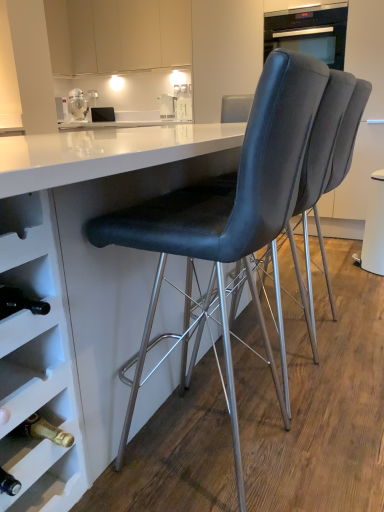
Question: Is matte black chair at center, the 3th chair positioned from the front, further to the viewer compared to black leather chair at center, marked as the second chair in a front-to-back arrangement?

Choices:
 (A) no
 (B) yes

Answer: (B)

Question: From the image's perspective, is matte black chair at center, the 3th chair positioned from the front, located beneath black leather chair at center, marked as the second chair in a front-to-back arrangement?

Choices:
 (A) no
 (B) yes

Answer: (A)

Question: Does matte black chair at center, the 3th chair positioned from the front, appear on the right side of black leather chair at center, marked as the second chair in a front-to-back arrangement?

Choices:
 (A) no
 (B) yes

Answer: (B)

Question: Is matte black chair at center, which is counted as the first chair, starting from the back, positioned in front of black leather chair at center, the 2th chair from the back?

Choices:
 (A) yes
 (B) no

Answer: (B)

Question: Would you say matte black chair at center, which is counted as the first chair, starting from the back, contains black leather chair at center, marked as the second chair in a front-to-back arrangement?

Choices:
 (A) no
 (B) yes

Answer: (A)

Question: Considering the positions of black leather chair at center, marked as the second chair in a front-to-back arrangement, and metallic silver blender at upper left in the image, is black leather chair at center, marked as the second chair in a front-to-back arrangement, taller or shorter than metallic silver blender at upper left?

Choices:
 (A) short
 (B) tall

Answer: (B)

Question: Does point (309, 309) appear closer or farther from the camera than point (72, 114)?

Choices:
 (A) closer
 (B) farther

Answer: (A)

Question: From a real-world perspective, is black leather chair at center, marked as the second chair in a front-to-back arrangement, above or below metallic silver blender at upper left?

Choices:
 (A) below
 (B) above

Answer: (A)

Question: Is black leather chair at center, the 2th chair from the back, wider or thinner than metallic silver blender at upper left?

Choices:
 (A) wide
 (B) thin

Answer: (A)

Question: Is white glossy table at center bigger or smaller than white matte drawer at lower left?

Choices:
 (A) small
 (B) big

Answer: (B)

Question: Is white glossy table at center in front of or behind white matte drawer at lower left in the image?

Choices:
 (A) front
 (B) behind

Answer: (A)

Question: Does point (140, 259) appear closer or farther from the camera than point (13, 243)?

Choices:
 (A) farther
 (B) closer

Answer: (A)

Question: Would you say white glossy table at center is to the left or to the right of white matte drawer at lower left in the picture?

Choices:
 (A) left
 (B) right

Answer: (B)

Question: Considering the positions of white matte drawer at lower left and white glossy table at center in the image, is white matte drawer at lower left taller or shorter than white glossy table at center?

Choices:
 (A) tall
 (B) short

Answer: (B)

Question: Is point (39, 246) positioned closer to the camera than point (157, 147)?

Choices:
 (A) farther
 (B) closer

Answer: (A)